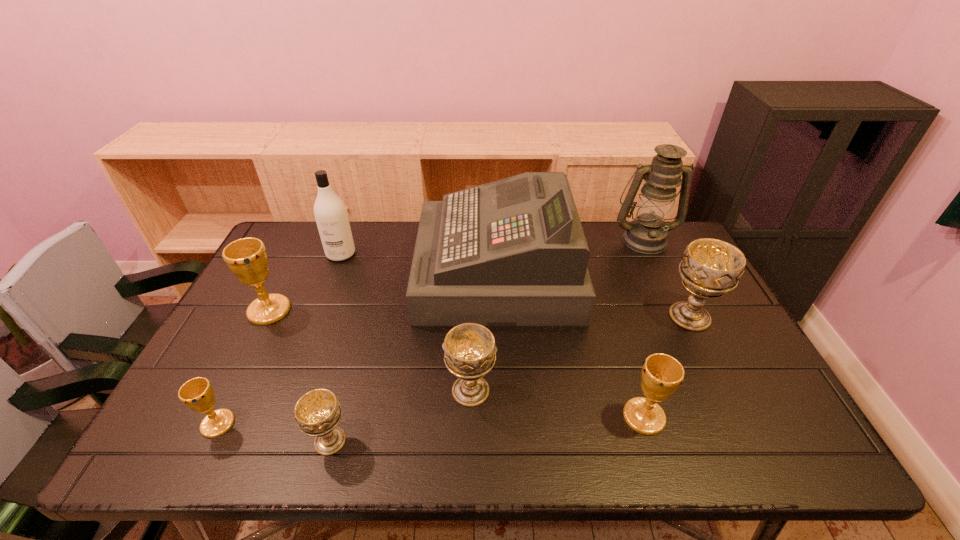
The image size is (960, 540). In order to click on the third object from right to left in this screenshot , I will do `click(662, 374)`.

I want to click on the smallest gold chalice, so click(197, 393).

Where is `the nearest white chalice`? This screenshot has height=540, width=960. the nearest white chalice is located at coordinates click(x=318, y=412).

The width and height of the screenshot is (960, 540). Find the location of `the smallest white chalice`. the smallest white chalice is located at coordinates (318, 412).

This screenshot has height=540, width=960. Find the location of `vacant space located 0.200m on the front of the oil lamp`. vacant space located 0.200m on the front of the oil lamp is located at coordinates (670, 295).

Where is `free space located 0.120m on the front-facing side of the gray cash register`? The width and height of the screenshot is (960, 540). free space located 0.120m on the front-facing side of the gray cash register is located at coordinates (381, 271).

Locate an element on the screen. This screenshot has width=960, height=540. free space located on the front-facing side of the gray cash register is located at coordinates 324,271.

Where is `vacant space located 0.360m on the front-facing side of the gray cash register`? vacant space located 0.360m on the front-facing side of the gray cash register is located at coordinates (306, 271).

Image resolution: width=960 pixels, height=540 pixels. In order to click on free location located 0.280m on the front-facing side of the shampoo in this screenshot , I will do pyautogui.click(x=313, y=327).

Locate an element on the screen. The image size is (960, 540). free space located on the front of the farthest gold chalice is located at coordinates (210, 427).